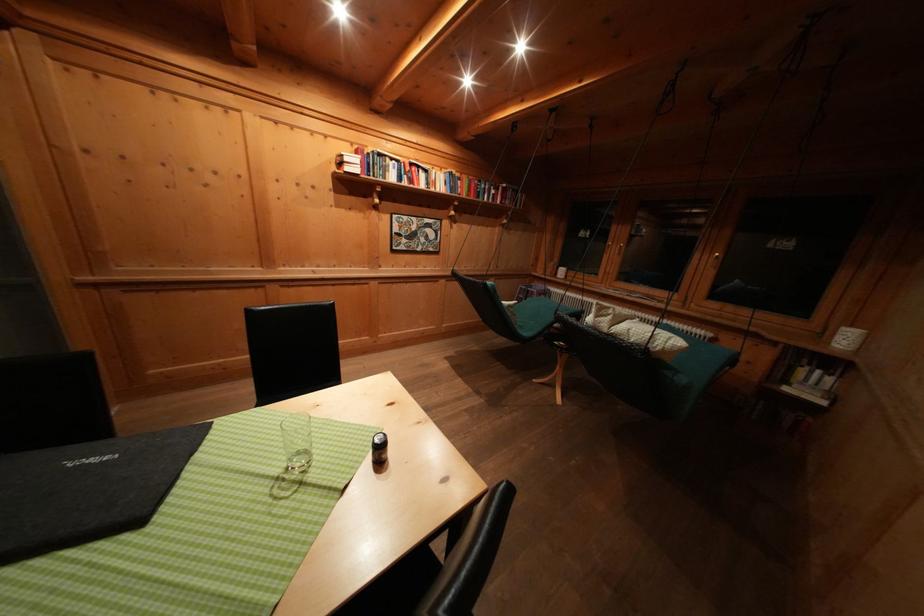
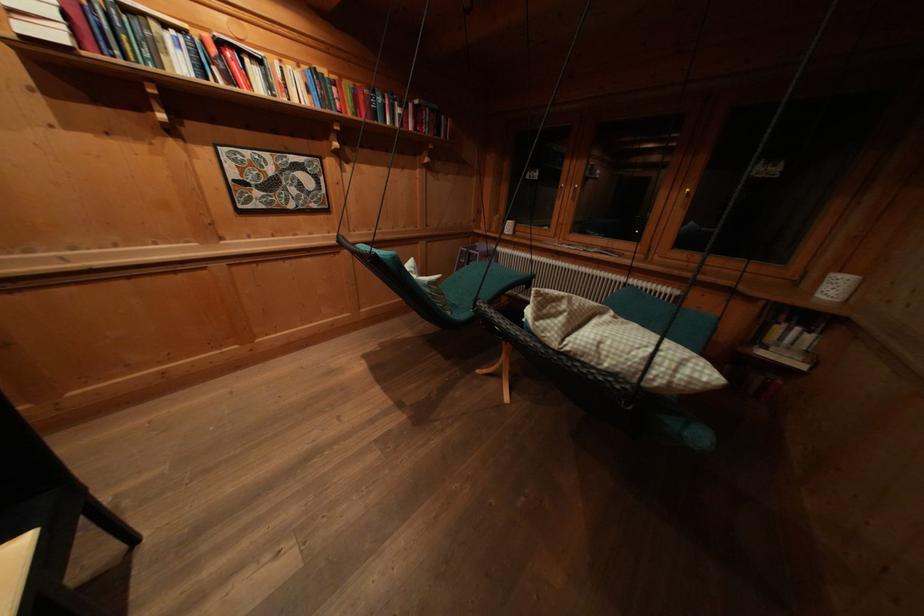
The point at (x=489, y=191) is marked in the first image. Where is the corresponding point in the second image?

(385, 103)